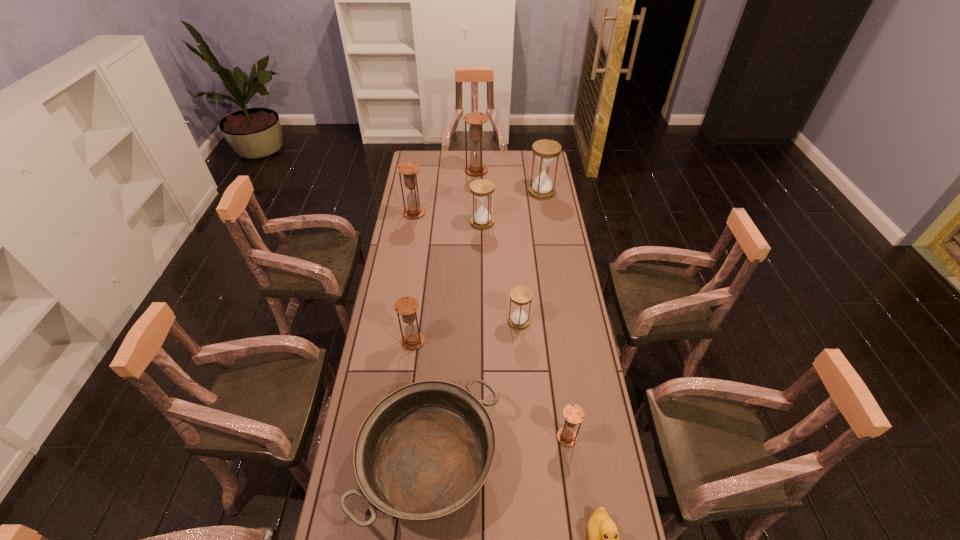
At what (x,y) coordinates should I click in order to perform the action: click on the nearest white hourglass. Please return your answer as a coordinate pair (x, y). The height and width of the screenshot is (540, 960). Looking at the image, I should click on (520, 295).

Locate an element on the screen. Image resolution: width=960 pixels, height=540 pixels. the nearest brown hourglass is located at coordinates point(574,414).

Where is `the nearest hourglass`? the nearest hourglass is located at coordinates (574, 414).

Locate an element on the screen. free space located 0.140m on the left of the tallest hourglass is located at coordinates (440, 171).

You are a GUI agent. You are given a task and a screenshot of the screen. Output one action in this format:
    pyautogui.click(x=<x>, y=<y>)
    Task: Click on the vacant space located 0.310m on the front of the second biggest brown hourglass
    
    Given the screenshot: What is the action you would take?
    pyautogui.click(x=406, y=264)

Image resolution: width=960 pixels, height=540 pixels. Identify the location of vacant space located on the back of the rightmost white hourglass. (540, 177).

Find the location of a particular element. The height and width of the screenshot is (540, 960). vacant region located 0.140m on the front of the second nearest white hourglass is located at coordinates (482, 249).

The height and width of the screenshot is (540, 960). I want to click on vacant region located on the front of the sixth farthest hourglass, so click(410, 367).

Where is `vacant space located on the front of the third hourglass from right to left`? The width and height of the screenshot is (960, 540). vacant space located on the front of the third hourglass from right to left is located at coordinates (524, 397).

Image resolution: width=960 pixels, height=540 pixels. What are the coordinates of `vacant space located 0.150m on the left of the smallest brown hourglass` in the screenshot? It's located at (510, 437).